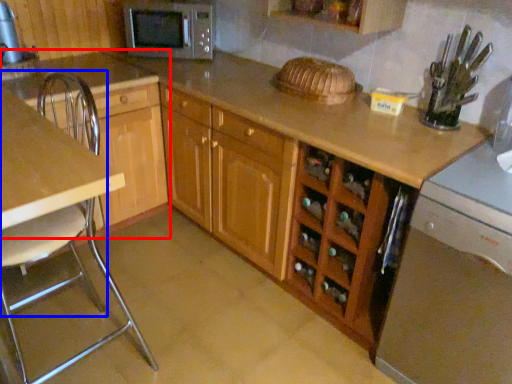
Question: Which of the following is the closest to the observer, cabinetry (highlighted by a red box) or chair (highlighted by a blue box)?

Choices:
 (A) cabinetry
 (B) chair

Answer: (B)